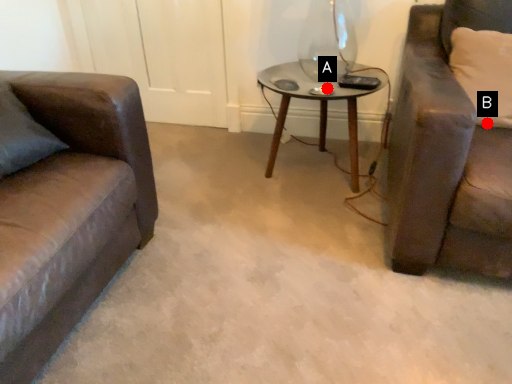
Question: Two points are circled on the image, labeled by A and B beside each circle. Which point is closer to the camera?

Choices:
 (A) A is closer
 (B) B is closer

Answer: (B)